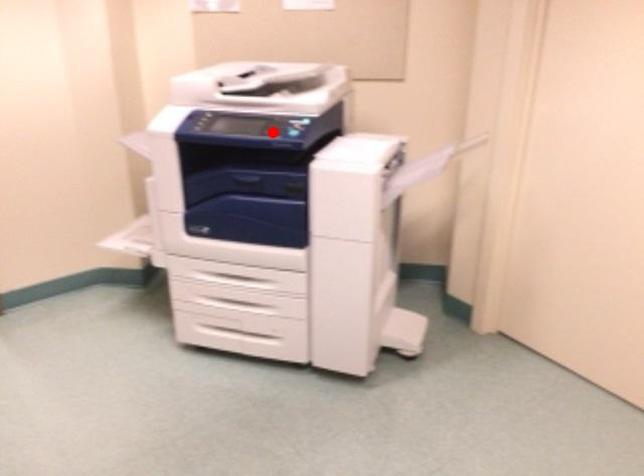
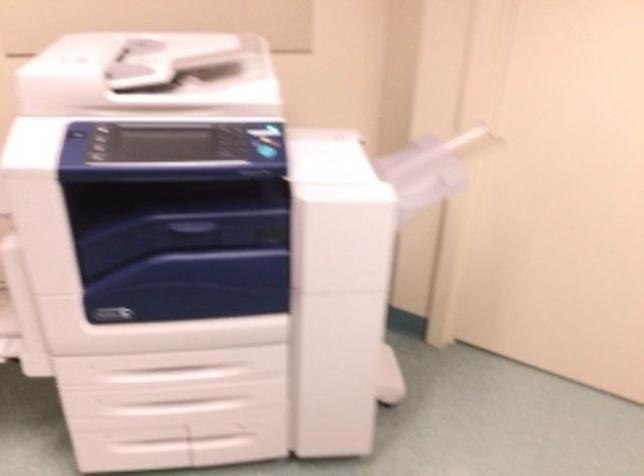
Question: I am providing you with two images of the same scene from different viewpoints. In image1, a red point is highlighted. Considering the same 3D point in image2, which of the following is correct?

Choices:
 (A) It is closer
 (B) It is farther

Answer: (A)